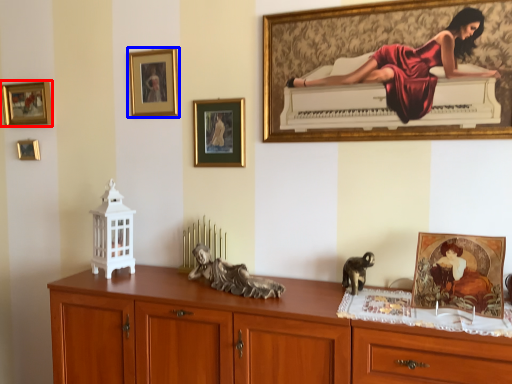
Question: Among these objects, which one is nearest to the camera, picture frame (highlighted by a red box) or picture frame (highlighted by a blue box)?

Choices:
 (A) picture frame
 (B) picture frame

Answer: (B)